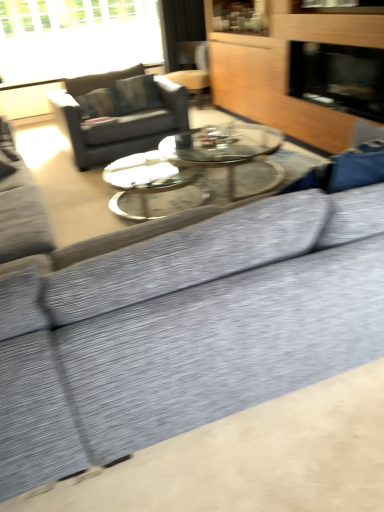
Question: Is wooden dresser at upper right smaller than black glass fireplace at upper right?

Choices:
 (A) no
 (B) yes

Answer: (A)

Question: From the image's perspective, does wooden dresser at upper right appear higher than black glass fireplace at upper right?

Choices:
 (A) no
 (B) yes

Answer: (B)

Question: Considering the relative positions of wooden dresser at upper right and black glass fireplace at upper right in the image provided, is wooden dresser at upper right behind black glass fireplace at upper right?

Choices:
 (A) yes
 (B) no

Answer: (B)

Question: Is wooden dresser at upper right at the right side of black glass fireplace at upper right?

Choices:
 (A) no
 (B) yes

Answer: (A)

Question: Considering the relative sizes of wooden dresser at upper right and black glass fireplace at upper right in the image provided, is wooden dresser at upper right taller than black glass fireplace at upper right?

Choices:
 (A) no
 (B) yes

Answer: (B)

Question: Considering the relative sizes of wooden dresser at upper right and black glass fireplace at upper right in the image provided, is wooden dresser at upper right shorter than black glass fireplace at upper right?

Choices:
 (A) no
 (B) yes

Answer: (A)

Question: Is wooden swivel chair at upper center taller than wooden dresser at upper right?

Choices:
 (A) yes
 (B) no

Answer: (B)

Question: Does wooden swivel chair at upper center have a larger size compared to wooden dresser at upper right?

Choices:
 (A) yes
 (B) no

Answer: (B)

Question: From a real-world perspective, is wooden swivel chair at upper center positioned over wooden dresser at upper right based on gravity?

Choices:
 (A) no
 (B) yes

Answer: (A)

Question: Is wooden swivel chair at upper center not close to wooden dresser at upper right?

Choices:
 (A) yes
 (B) no

Answer: (A)

Question: From the image's perspective, is wooden swivel chair at upper center located above wooden dresser at upper right?

Choices:
 (A) no
 (B) yes

Answer: (B)

Question: Is wooden swivel chair at upper center oriented away from wooden dresser at upper right?

Choices:
 (A) no
 (B) yes

Answer: (A)

Question: Is wooden swivel chair at upper center bigger than dark gray fabric couch at upper left?

Choices:
 (A) yes
 (B) no

Answer: (B)